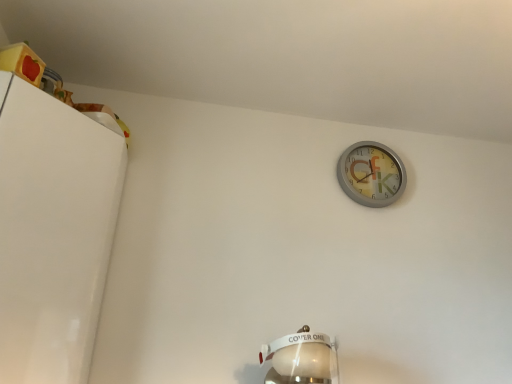
What do you see at coordinates (371, 174) in the screenshot? I see `metallic silver clock at upper right` at bounding box center [371, 174].

I want to click on metallic silver clock at upper right, so click(x=371, y=174).

What is the approximate height of metallic silver clock at upper right?

It is 11.08 inches.

Where is `metallic silver clock at upper right`? metallic silver clock at upper right is located at coordinates (371, 174).